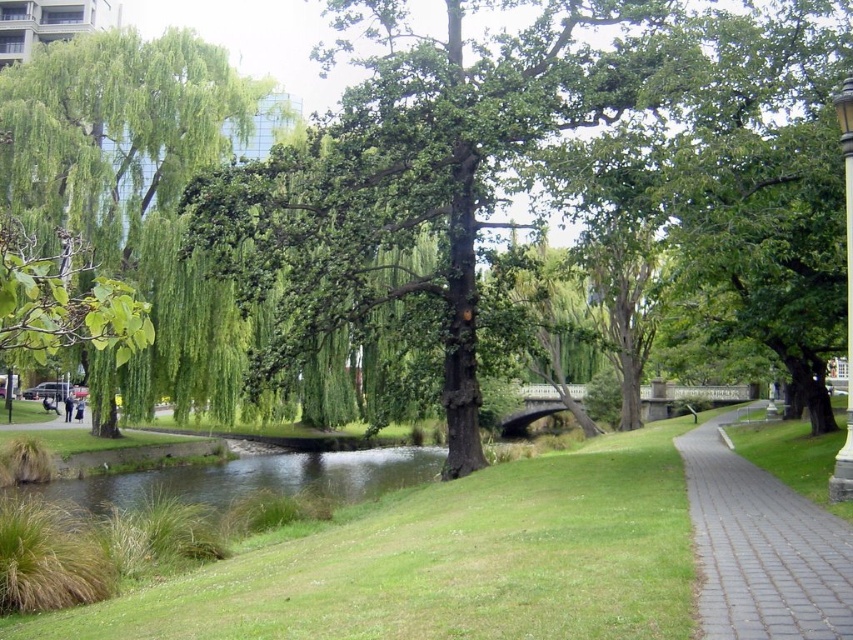
Who is positioned more to the left, green leafy willow at upper left or paved brick path at lower right?

green leafy willow at upper left is more to the left.

Which of these two, green leafy willow at upper left or paved brick path at lower right, stands taller?

With more height is green leafy willow at upper left.

Which is in front, point (73, 134) or point (786, 577)?

Point (786, 577)

You are a GUI agent. You are given a task and a screenshot of the screen. Output one action in this format:
    pyautogui.click(x=<x>, y=<y>)
    Task: Click on the green leafy willow at upper left
    The width and height of the screenshot is (853, 640).
    Given the screenshot: What is the action you would take?
    pyautogui.click(x=132, y=182)